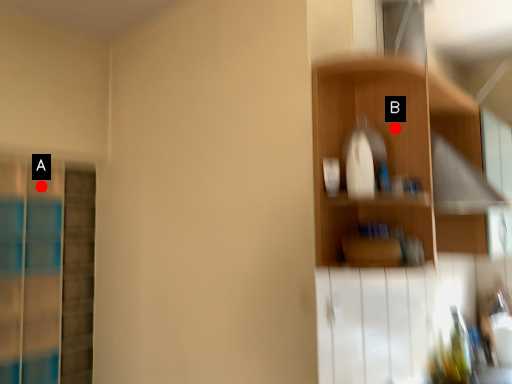
Question: Two points are circled on the image, labeled by A and B beside each circle. Which point is farther to the camera?

Choices:
 (A) A is further
 (B) B is further

Answer: (A)